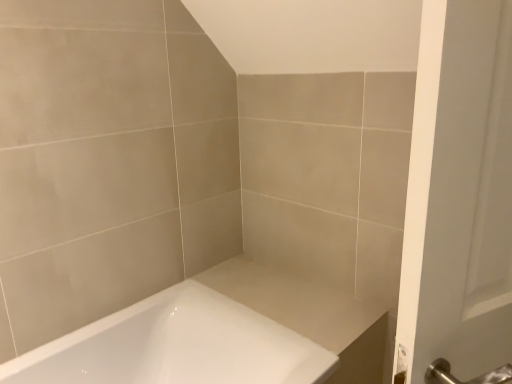
The height and width of the screenshot is (384, 512). In order to click on free spot above white smooth countertop at center (from a real-world perspective) in this screenshot , I will do `click(285, 292)`.